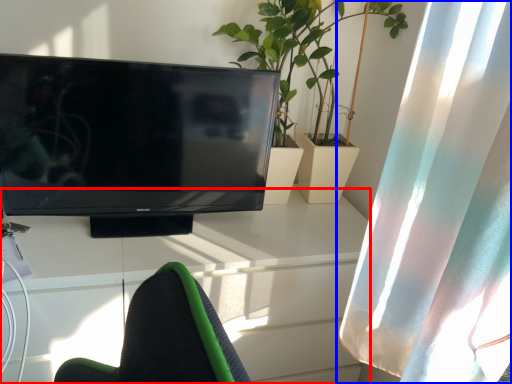
Question: Among these objects, which one is farthest to the camera, desk (highlighted by a red box) or curtain (highlighted by a blue box)?

Choices:
 (A) desk
 (B) curtain

Answer: (A)